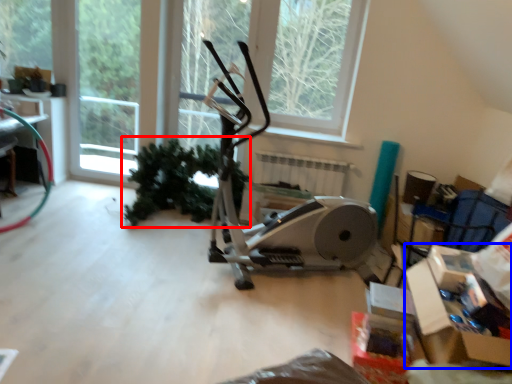
Question: Which object appears farthest to the camera in this image, plant (highlighted by a red box) or cardboard box (highlighted by a blue box)?

Choices:
 (A) plant
 (B) cardboard box

Answer: (A)